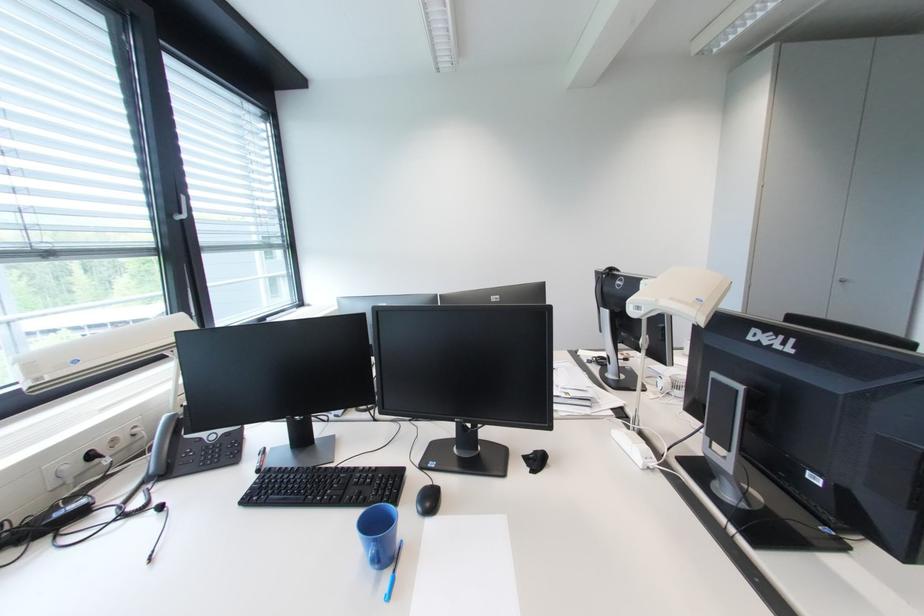
The image size is (924, 616). Identify the location of white window handle. (181, 208).